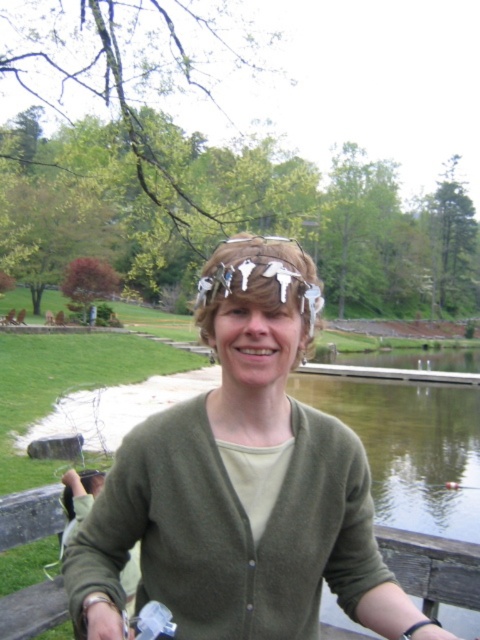
You are a fashion designer analyzing the image. You need to determine where a specific point is located on the person. The point is at coordinates point (241, 483). Which item of clothing is this point on?

The point (241, 483) is located on the matte green cardigan at center.

You are an architect designing a new park layout and need to place a statue exactly at the center of the park. The park has a paved pathway that curves through the grass leading towards the water. If the statue must be placed at the exact center point of the park, which is at coordinate point 0.756, 0.504, where should you position it relative to the matte green cardigan at center?

The statue should be positioned exactly where the matte green cardigan at center is located since the cardigan is already at the park center coordinates of [241,483].